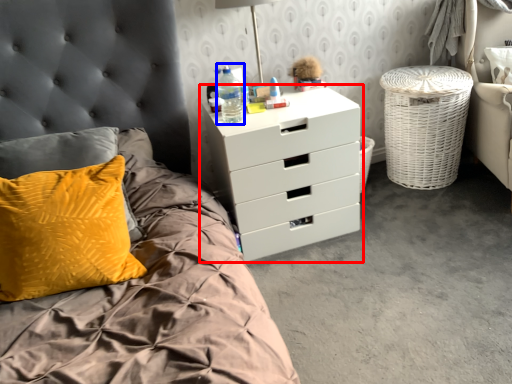
Question: Among these objects, which one is nearest to the camera, chest of drawers (highlighted by a red box) or bottle (highlighted by a blue box)?

Choices:
 (A) chest of drawers
 (B) bottle

Answer: (A)